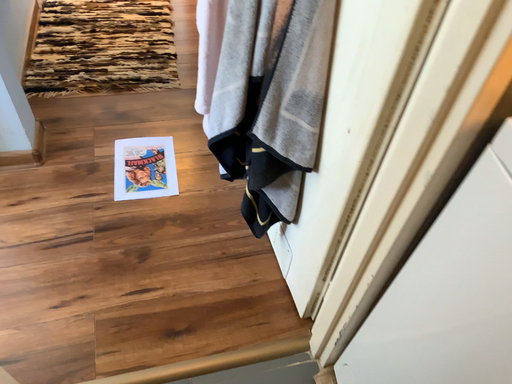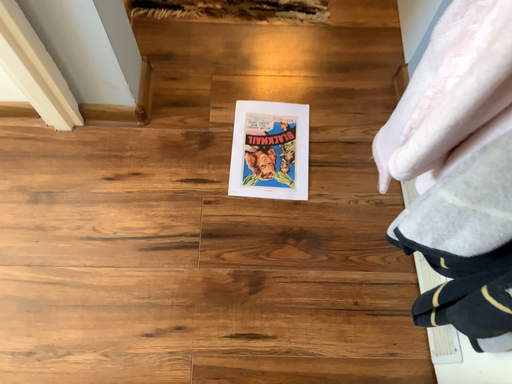
Question: How did the camera likely rotate when shooting the video?

Choices:
 (A) rotated downward
 (B) rotated upward

Answer: (A)